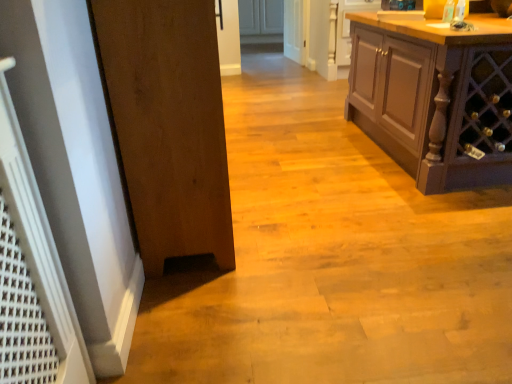
The image size is (512, 384). What do you see at coordinates (168, 124) in the screenshot?
I see `wooden door at left` at bounding box center [168, 124].

I want to click on white glossy door at center, so [x=296, y=30].

Is wooden door at left thinner than white glossy door at center?

No, wooden door at left is not thinner than white glossy door at center.

Which is behind, point (124, 145) or point (305, 1)?

The point (305, 1) is farther.

From the image's perspective, who appears lower, wooden door at left or white glossy door at center?

From the image's view, wooden door at left is below.

From a real-world perspective, relative to white glossy door at center, is wooden door at left vertically above or below?

wooden door at left is above white glossy door at center.

Is matte brown cabinet at right turned away from wooden door at left?

No, matte brown cabinet at right is not facing away from wooden door at left.

From a real-world perspective, is matte brown cabinet at right positioned above or below wooden door at left?

In terms of real-world spatial position, matte brown cabinet at right is below wooden door at left.

Which is behind, point (451, 119) or point (219, 104)?

The point (451, 119) is farther from the camera.

Does matte brown cabinet at right lie behind wooden door at left?

Yes, matte brown cabinet at right is further from the viewer.

Could you tell me if white glossy door at center is facing wooden door at left?

No, white glossy door at center is not facing towards wooden door at left.

Does point (295, 24) appear closer or farther from the camera than point (133, 202)?

Clearly, point (295, 24) is more distant from the camera than point (133, 202).

Is white glossy door at center far from wooden door at left?

That's right, there is a large distance between white glossy door at center and wooden door at left.

Is white glossy door at center shorter than wooden door at left?

Yes.

Can you confirm if wooden door at left is shorter than matte brown cabinet at right?

In fact, wooden door at left may be taller than matte brown cabinet at right.

In the scene shown: Is wooden door at left not inside matte brown cabinet at right?

wooden door at left lies outside matte brown cabinet at right's area.

Which is more to the left, wooden door at left or matte brown cabinet at right?

From the viewer's perspective, wooden door at left appears more on the left side.

Find the location of a particular element. The image size is (512, 384). cabinetry behind the wooden door at left is located at coordinates (435, 97).

Measure the distance from white glossy door at center to matte brown cabinet at right.

white glossy door at center is 2.87 meters away from matte brown cabinet at right.

Could you tell me if white glossy door at center is turned towards matte brown cabinet at right?

No, white glossy door at center is not facing towards matte brown cabinet at right.

Which is further, [306,41] or [430,177]?

Positioned behind is point [306,41].

Find the location of a particular element. The width and height of the screenshot is (512, 384). screen door that is on the left side of matte brown cabinet at right is located at coordinates (296, 30).

Does point (413, 80) come closer to viewer compared to point (297, 46)?

Yes, it is in front of point (297, 46).

Does matte brown cabinet at right have a greater height compared to white glossy door at center?

Correct, matte brown cabinet at right is much taller as white glossy door at center.

Based on the photo, is matte brown cabinet at right directly adjacent to white glossy door at center?

No, matte brown cabinet at right is not with white glossy door at center.

From a real-world perspective, is matte brown cabinet at right positioned above or below white glossy door at center?

matte brown cabinet at right is above white glossy door at center.

Locate an element on the screen. This screenshot has height=384, width=512. screen door above the wooden door at left (from the image's perspective) is located at coordinates (296, 30).

I want to click on door on the left of matte brown cabinet at right, so click(168, 124).

Considering their positions, is wooden door at left positioned further to matte brown cabinet at right than white glossy door at center?

Based on the image, white glossy door at center appears to be further to matte brown cabinet at right.

Estimate the real-world distances between objects in this image. Which object is closer to white glossy door at center, matte brown cabinet at right or wooden door at left?

matte brown cabinet at right lies closer to white glossy door at center than the other object.

Estimate the real-world distances between objects in this image. Which object is further from white glossy door at center, wooden door at left or matte brown cabinet at right?

Based on the image, wooden door at left appears to be further to white glossy door at center.

Looking at the image, which one is located further to wooden door at left, white glossy door at center or matte brown cabinet at right?

white glossy door at center.

Based on their spatial positions, is matte brown cabinet at right or white glossy door at center further from wooden door at left?

white glossy door at center.

When comparing their distances from matte brown cabinet at right, does white glossy door at center or wooden door at left seem further?

white glossy door at center lies further to matte brown cabinet at right than the other object.

Where is `cabinetry between wooden door at left and white glossy door at center in the front-back direction`? This screenshot has width=512, height=384. cabinetry between wooden door at left and white glossy door at center in the front-back direction is located at coordinates (435, 97).